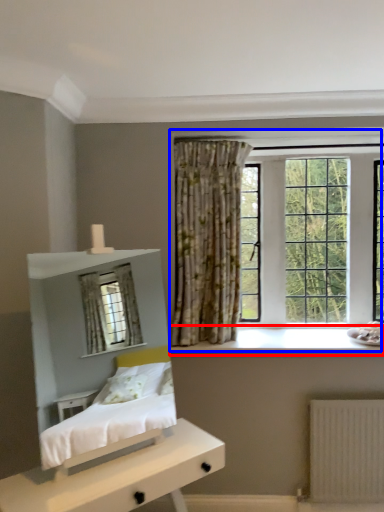
Question: Which object appears farthest to the camera in this image, window sill (highlighted by a red box) or window (highlighted by a blue box)?

Choices:
 (A) window sill
 (B) window

Answer: (B)